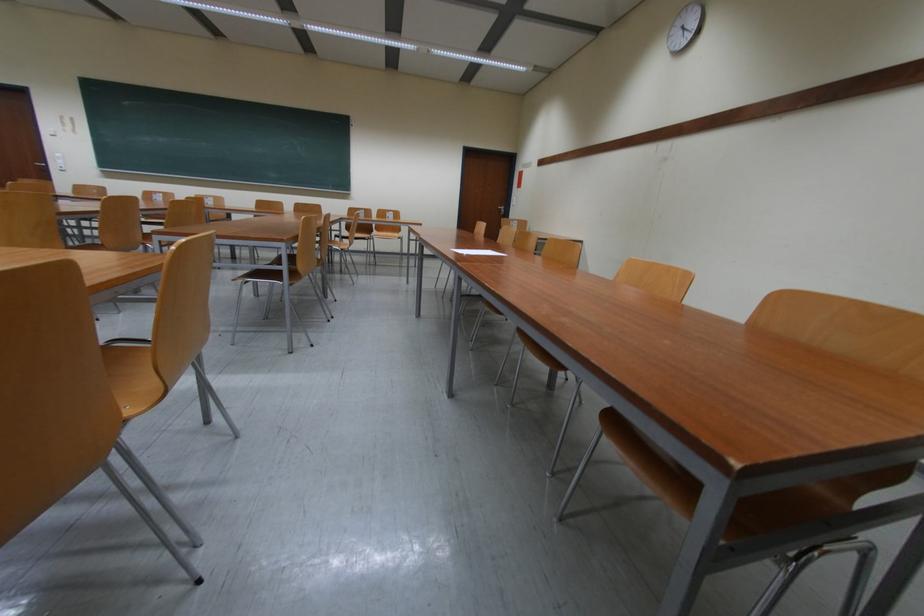
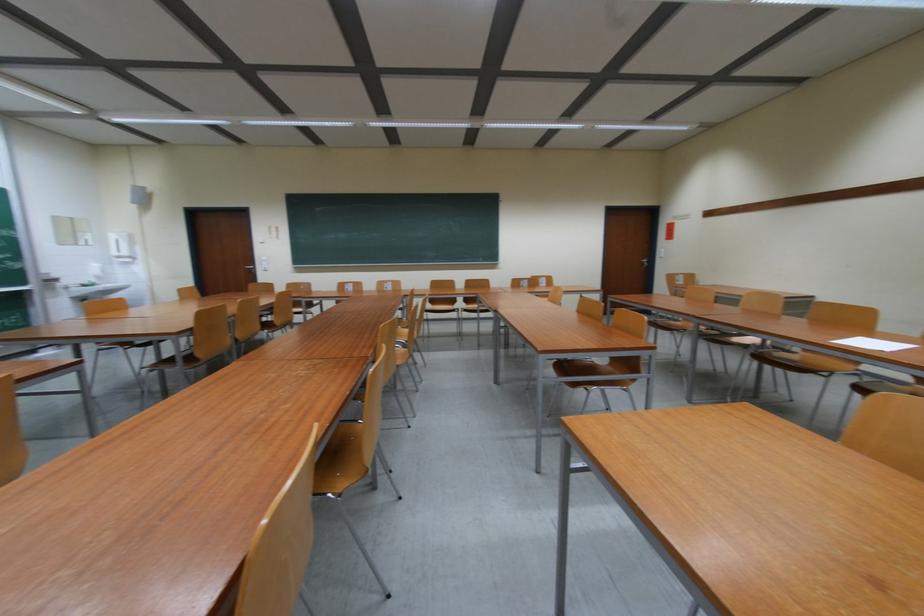
Question: What movement of the cameraman would produce the second image?

Choices:
 (A) Left
 (B) Right
 (C) Forward
 (D) Backward

Answer: (A)